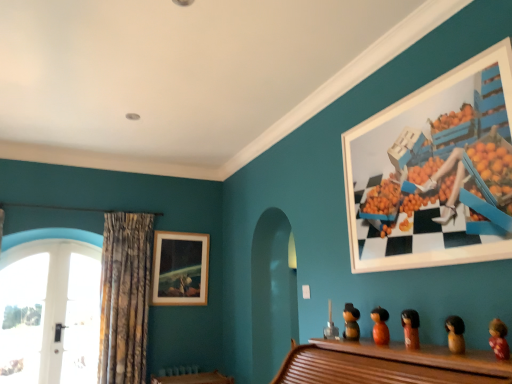
Identify the location of wooden figurine at center, positioned as the fifth toy in front-to-back order. This screenshot has height=384, width=512. (351, 322).

At what (x,y) coordinates should I click in order to perform the action: click on orange matte wooden doll at center, which is the fourth toy from right to left. Please return your answer as a coordinate pair (x, y). The image size is (512, 384). Looking at the image, I should click on (380, 326).

Where is `textured brown curtain at left`? The height and width of the screenshot is (384, 512). textured brown curtain at left is located at coordinates (125, 297).

The image size is (512, 384). Identify the location of white matte picture frame at upper right, the first picture frame in the top-to-bottom sequence. (433, 170).

Locate an element on the screen. white glass door at left is located at coordinates (49, 307).

What do you see at coordinates (411, 328) in the screenshot? I see `brown wooden figurine at center, the third toy positioned from the right` at bounding box center [411, 328].

The height and width of the screenshot is (384, 512). What are the coordinates of `fluffy pink doll at lower right, which is counted as the 1th toy, starting from the front` in the screenshot? It's located at (499, 339).

Considering the sizes of objects white glass door at left and textured brown curtain at left in the image provided, who is thinner, white glass door at left or textured brown curtain at left?

Thinner between the two is white glass door at left.

Is point (85, 320) farther from camera compared to point (124, 278)?

Yes, it is.

Is white glass door at left at the left side of textured brown curtain at left?

Correct, you'll find white glass door at left to the left of textured brown curtain at left.

Which of these two, white glass door at left or textured brown curtain at left, is smaller?

With smaller size is white glass door at left.

Are wooden picture frame at upper center, marked as the 1th picture frame in a back-to-front arrangement, and white glass door at left beside each other?

No, wooden picture frame at upper center, marked as the 1th picture frame in a back-to-front arrangement, is not with white glass door at left.

Which is correct: wooden picture frame at upper center, the 2th picture frame when ordered from top to bottom, is inside white glass door at left, or outside of it?

wooden picture frame at upper center, the 2th picture frame when ordered from top to bottom, lies outside white glass door at left.

Does wooden picture frame at upper center, which ranks as the 1th picture frame in left-to-right order, have a greater height compared to white glass door at left?

In fact, wooden picture frame at upper center, which ranks as the 1th picture frame in left-to-right order, may be shorter than white glass door at left.

Visually, is wooden figurine at center, positioned as the fifth toy in front-to-back order, positioned to the left or to the right of white matte picture frame at upper right, the 2th picture frame positioned from the left?

Clearly, wooden figurine at center, positioned as the fifth toy in front-to-back order, is on the left of white matte picture frame at upper right, the 2th picture frame positioned from the left, in the image.

Does wooden figurine at center, which is the 1th toy in back-to-front order, lie behind white matte picture frame at upper right, the 2th picture frame positioned from the left?

Yes, wooden figurine at center, which is the 1th toy in back-to-front order, is further from the camera.

Considering the sizes of objects wooden figurine at center, which is the 1th toy in back-to-front order, and white matte picture frame at upper right, the 2th picture frame positioned from the left, in the image provided, who is wider, wooden figurine at center, which is the 1th toy in back-to-front order, or white matte picture frame at upper right, the 2th picture frame positioned from the left,?

wooden figurine at center, which is the 1th toy in back-to-front order, is wider.

Identify the location of picture frame that appears on the right of wooden figurine at center, which is the 1th toy in back-to-front order. The height and width of the screenshot is (384, 512). (433, 170).

How much distance is there between wooden picture frame at upper center, which appears as the 2th picture frame when viewed from the front, and wooden figurine at center, positioned as the first toy in left-to-right order?

wooden picture frame at upper center, which appears as the 2th picture frame when viewed from the front, is 2.25 meters away from wooden figurine at center, positioned as the first toy in left-to-right order.

How many degrees apart are the facing directions of wooden picture frame at upper center, the 2th picture frame when ordered from top to bottom, and wooden figurine at center, which is the 1th toy in back-to-front order?

The facing directions of wooden picture frame at upper center, the 2th picture frame when ordered from top to bottom, and wooden figurine at center, which is the 1th toy in back-to-front order, are 90.9 degrees apart.

Which object is closer to the camera taking this photo, wooden picture frame at upper center, acting as the first picture frame starting from the bottom, or wooden figurine at center, positioned as the first toy in left-to-right order?

wooden figurine at center, positioned as the first toy in left-to-right order, is in front.

From a real-world perspective, does wooden picture frame at upper center, marked as the 1th picture frame in a back-to-front arrangement, stand above wooden figurine at center, which is the 1th toy in back-to-front order?

Yes, from a real-world perspective, wooden picture frame at upper center, marked as the 1th picture frame in a back-to-front arrangement, is on top of wooden figurine at center, which is the 1th toy in back-to-front order.

Which is in front, point (499, 347) or point (416, 326)?

The point (499, 347) is more forward.

Is fluffy pink doll at lower right, acting as the fifth toy starting from the back, oriented away from brown wooden figurine at center, acting as the 3th toy starting from the back?

No, brown wooden figurine at center, acting as the 3th toy starting from the back, is not at the back of fluffy pink doll at lower right, acting as the fifth toy starting from the back.

Is fluffy pink doll at lower right, acting as the fifth toy starting from the back, not near brown wooden figurine at center, acting as the 3th toy starting from the back?

No, fluffy pink doll at lower right, acting as the fifth toy starting from the back, is not far from brown wooden figurine at center, acting as the 3th toy starting from the back.

Between fluffy pink doll at lower right, acting as the fifth toy starting from the back, and brown wooden figurine at center, which is the 3th toy from front to back, which one has smaller size?

fluffy pink doll at lower right, acting as the fifth toy starting from the back, is smaller.

From the picture: How much distance is there between wooden picture frame at upper center, which ranks as the 1th picture frame in left-to-right order, and brown wooden doll at lower right, which ranks as the fourth toy in back-to-front order?

wooden picture frame at upper center, which ranks as the 1th picture frame in left-to-right order, and brown wooden doll at lower right, which ranks as the fourth toy in back-to-front order, are 9.14 feet apart.

Is wooden picture frame at upper center, which appears as the 2th picture frame when viewed from the front, aimed at brown wooden doll at lower right, which appears as the 2th toy when viewed from the right?

Yes, wooden picture frame at upper center, which appears as the 2th picture frame when viewed from the front, is oriented towards brown wooden doll at lower right, which appears as the 2th toy when viewed from the right.

From a real-world perspective, starting from the brown wooden doll at lower right, which is the fourth toy in left-to-right order, which picture frame is the 1st one vertically above it? Please provide its 2D coordinates.

[(180, 268)]

Is wooden picture frame at upper center, the 2th picture frame when ordered from top to bottom, inside or outside of brown wooden doll at lower right, which ranks as the fourth toy in back-to-front order?

The correct answer is: outside.

Looking at this image, from the image's perspective, between wooden figurine at center, positioned as the first toy in left-to-right order, and brown wooden figurine at center, acting as the 3th toy starting from the back, who is located below?

From the image's view, wooden figurine at center, positioned as the first toy in left-to-right order, is below.

From the wooden figurine at center, the 5th toy when ordered from right to left, count 2nd toy to the right and point to it. Please provide its 2D coordinates.

[(411, 328)]

This screenshot has width=512, height=384. I want to click on curtain above the white glass door at left (from the image's perspective), so click(x=125, y=297).

In order to click on window below the wooden picture frame at upper center, marked as the 1th picture frame in a back-to-front arrangement (from the image's perspective) in this screenshot , I will do `click(49, 307)`.

Based on their spatial positions, is wooden picture frame at upper center, which appears as the 2th picture frame when viewed from the front, or white glass door at left further from white matte picture frame at upper right, acting as the 2th picture frame starting from the back?

white glass door at left lies further to white matte picture frame at upper right, acting as the 2th picture frame starting from the back, than the other object.

Estimate the real-world distances between objects in this image. Which object is closer to white matte picture frame at upper right, which is counted as the 1th picture frame, starting from the front, brown wooden doll at lower right, the second toy from the front, or wooden picture frame at upper center, placed as the 2th picture frame when sorted from right to left?

Among the two, brown wooden doll at lower right, the second toy from the front, is located nearer to white matte picture frame at upper right, which is counted as the 1th picture frame, starting from the front.

When comparing their distances from wooden figurine at center, positioned as the first toy in left-to-right order, does white matte picture frame at upper right, the 2th picture frame positioned from the left, or white glass door at left seem further?

white glass door at left lies further to wooden figurine at center, positioned as the first toy in left-to-right order, than the other object.

Looking at the image, which one is located closer to textured brown curtain at left, orange matte wooden doll at center, which is the fourth toy from right to left, or wooden figurine at center, the 5th toy when ordered from right to left?

Based on the image, wooden figurine at center, the 5th toy when ordered from right to left, appears to be nearer to textured brown curtain at left.

When comparing their distances from white matte picture frame at upper right, the 2th picture frame positioned from the left, does textured brown curtain at left or wooden figurine at center, positioned as the fifth toy in front-to-back order, seem further?

textured brown curtain at left.

Based on their spatial positions, is fluffy pink doll at lower right, acting as the fifth toy starting from the back, or white glass door at left further from wooden picture frame at upper center, marked as the 1th picture frame in a back-to-front arrangement?

fluffy pink doll at lower right, acting as the fifth toy starting from the back, is positioned further to the anchor wooden picture frame at upper center, marked as the 1th picture frame in a back-to-front arrangement.

From the image, which object appears to be farther from white matte picture frame at upper right, which ranks as the 1th picture frame in right-to-left order, wooden picture frame at upper center, marked as the 1th picture frame in a back-to-front arrangement, or textured brown curtain at left?

textured brown curtain at left is further to white matte picture frame at upper right, which ranks as the 1th picture frame in right-to-left order.

Considering their positions, is brown wooden doll at lower right, the second toy from the front, positioned further to orange matte wooden doll at center, the fourth toy in the front-to-back sequence, than wooden figurine at center, positioned as the fifth toy in front-to-back order?

Among the two, brown wooden doll at lower right, the second toy from the front, is located further to orange matte wooden doll at center, the fourth toy in the front-to-back sequence.

This screenshot has height=384, width=512. Find the location of `toy between white glass door at left and orange matte wooden doll at center, which is the 2th toy from back to front, from left to right`. toy between white glass door at left and orange matte wooden doll at center, which is the 2th toy from back to front, from left to right is located at coordinates (351, 322).

Image resolution: width=512 pixels, height=384 pixels. I want to click on curtain between wooden figurine at center, the 5th toy when ordered from right to left, and wooden picture frame at upper center, the 2th picture frame when ordered from top to bottom, from front to back, so click(x=125, y=297).

Find the location of a particular element. curtain between white matte picture frame at upper right, which ranks as the 1th picture frame in right-to-left order, and wooden picture frame at upper center, acting as the first picture frame starting from the bottom, in the front-back direction is located at coordinates point(125,297).

What are the coordinates of `picture frame situated between white glass door at left and wooden figurine at center, the 5th toy when ordered from right to left, from left to right` in the screenshot? It's located at (180, 268).